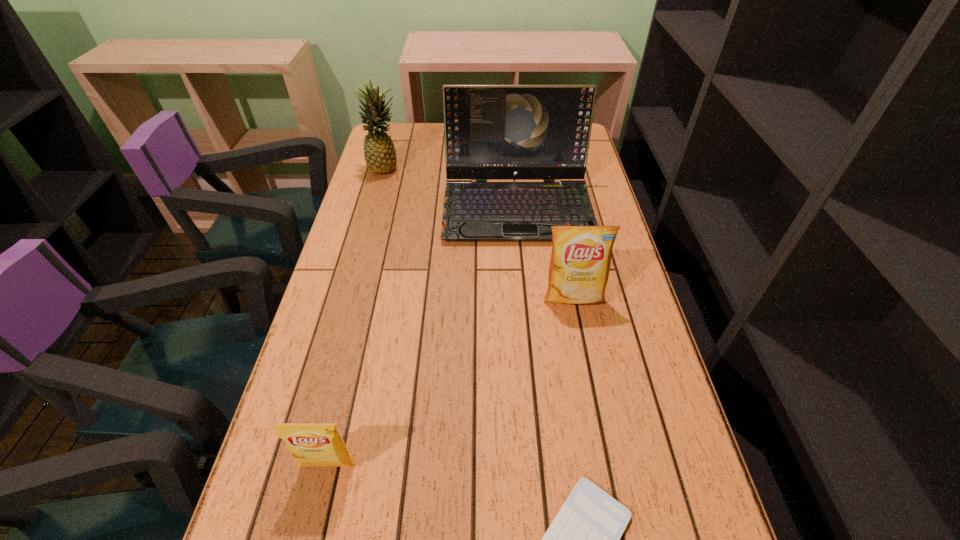
Identify the location of pineapple that is positioned at the left edge. (380, 156).

This screenshot has height=540, width=960. I want to click on crisp (potato chip) at the left edge, so click(x=312, y=444).

Where is `laptop computer at the right edge`? laptop computer at the right edge is located at coordinates (492, 132).

Identify the location of crisp (potato chip) located in the right edge section of the desktop. (579, 267).

This screenshot has width=960, height=540. Identify the location of free location at the far edge. pyautogui.click(x=427, y=140).

Identify the location of vacant space at the left edge of the desktop. (326, 500).

This screenshot has height=540, width=960. Find the location of `vacant space at the right edge of the desktop`. vacant space at the right edge of the desktop is located at coordinates (630, 295).

Where is `free space at the far left corner`? free space at the far left corner is located at coordinates (407, 144).

I want to click on free space that is in between the shorter crisp (potato chip) and the farther crisp (potato chip), so click(x=451, y=381).

The width and height of the screenshot is (960, 540). Find the location of `free space between the taller crisp (potato chip) and the shorter crisp (potato chip)`. free space between the taller crisp (potato chip) and the shorter crisp (potato chip) is located at coordinates (451, 381).